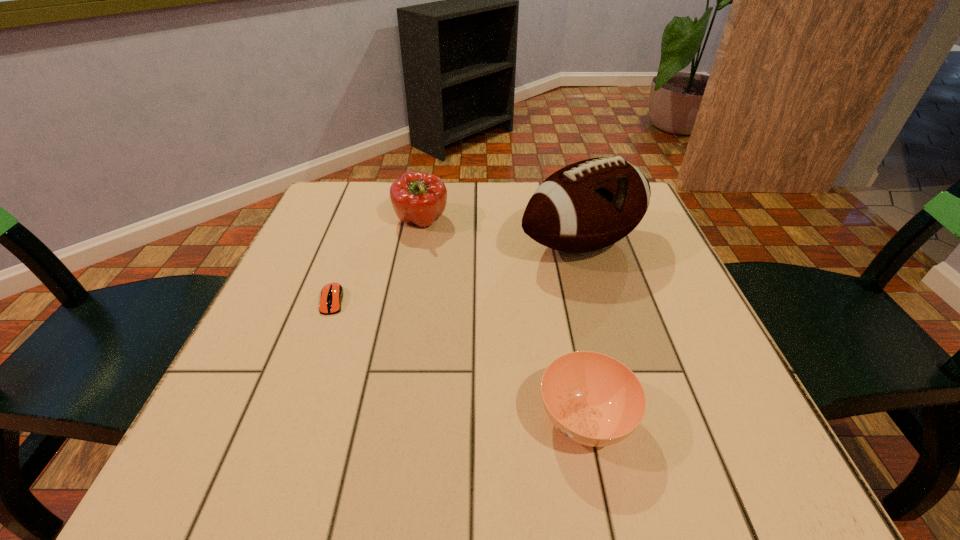
At what (x,y) coordinates should I click in order to perform the action: click on free spot at the right edge of the desktop. Please return your answer as a coordinate pair (x, y). The image size is (960, 540). Looking at the image, I should click on (732, 379).

In the image, there is a desktop. At what (x,y) coordinates should I click in order to perform the action: click on free region at the far left corner. Please return your answer as a coordinate pair (x, y). The width and height of the screenshot is (960, 540). Looking at the image, I should click on (368, 207).

Locate an element on the screen. vacant space in between the soup bowl and the shortest object is located at coordinates (459, 360).

Where is `unoccupied area between the second object from left to right and the soup bowl`? Image resolution: width=960 pixels, height=540 pixels. unoccupied area between the second object from left to right and the soup bowl is located at coordinates (503, 320).

This screenshot has height=540, width=960. Identify the location of vacant region between the pepper and the soup bowl. (503, 320).

Where is `empty space between the football (American) and the computer mouse`? The image size is (960, 540). empty space between the football (American) and the computer mouse is located at coordinates (457, 272).

At what (x,y) coordinates should I click in order to perform the action: click on blank region between the leftmost object and the second tallest object. Please return your answer as a coordinate pair (x, y). Looking at the image, I should click on (377, 261).

Locate an element on the screen. empty location between the nearest object and the tallest object is located at coordinates (584, 332).

This screenshot has height=540, width=960. In order to click on vacant region between the leftmost object and the nearest object in this screenshot , I will do `click(459, 360)`.

The width and height of the screenshot is (960, 540). I want to click on empty space that is in between the second nearest object and the soup bowl, so click(459, 360).